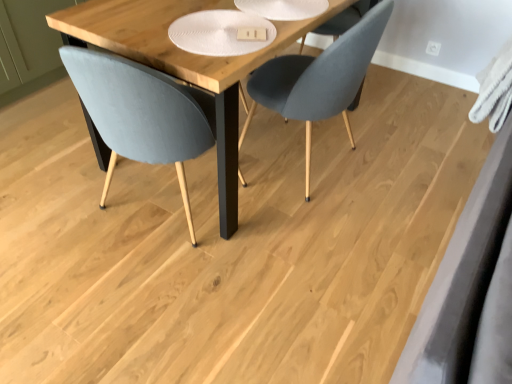
This screenshot has height=384, width=512. I want to click on vacant area that lies between matte gray chair at left, which is counted as the first chair, starting from the left, and wooden table at center, so click(121, 209).